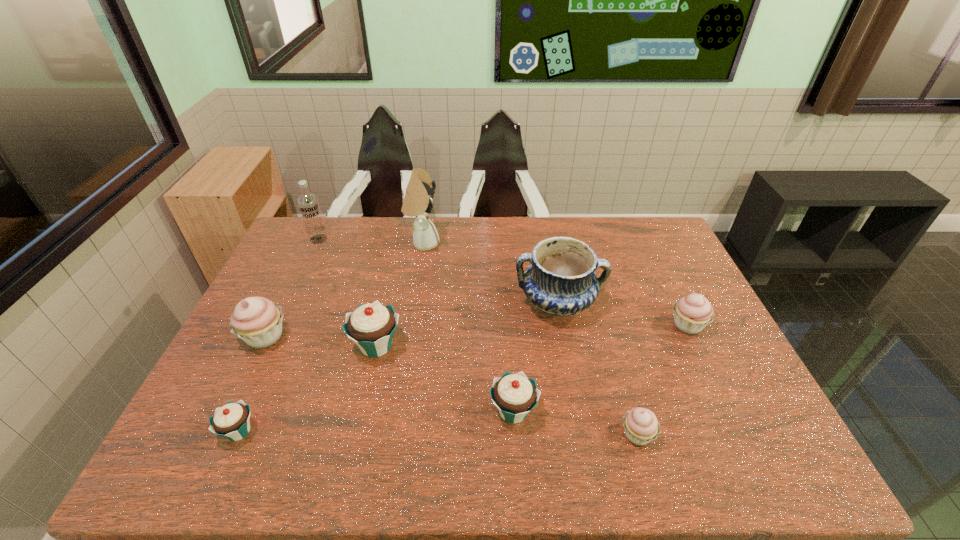
This screenshot has height=540, width=960. Find the location of `pink cupcake that stands as the second closest to the vodka`. pink cupcake that stands as the second closest to the vodka is located at coordinates (641, 426).

Identify which pink cupcake is the nearest to the smallest teal cupcake. Please provide its 2D coordinates. Your answer should be formatted as a tuple, i.e. [(x, y)], where the tuple contains the x and y coordinates of a point satisfying the conditions above.

[(257, 321)]

Where is `teal cupcake that stands as the second closest to the second pink cupcake from left to right`? The width and height of the screenshot is (960, 540). teal cupcake that stands as the second closest to the second pink cupcake from left to right is located at coordinates (371, 326).

Locate an element on the screen. This screenshot has width=960, height=540. the third closest teal cupcake relative to the pottery is located at coordinates (232, 421).

Where is `vacant space that satisfies the following two spatial constraints: 1. on the front side of the smallest pink cupcake; 2. on the left side of the fourth cupcake from left to right`? vacant space that satisfies the following two spatial constraints: 1. on the front side of the smallest pink cupcake; 2. on the left side of the fourth cupcake from left to right is located at coordinates point(515,434).

The height and width of the screenshot is (540, 960). Find the location of `blank space that satisfies the following two spatial constraints: 1. on the front label of the vodka; 2. on the left side of the rightmost teal cupcake`. blank space that satisfies the following two spatial constraints: 1. on the front label of the vodka; 2. on the left side of the rightmost teal cupcake is located at coordinates (238, 411).

Where is `vacant space that satisfies the following two spatial constraints: 1. on the front label of the vodka; 2. on the left side of the second pink cupcake from right to left`? The width and height of the screenshot is (960, 540). vacant space that satisfies the following two spatial constraints: 1. on the front label of the vodka; 2. on the left side of the second pink cupcake from right to left is located at coordinates (228, 434).

Where is `blank space that satisfies the following two spatial constraints: 1. at the front face of the rightmost pink cupcake; 2. on the left side of the doll`? blank space that satisfies the following two spatial constraints: 1. at the front face of the rightmost pink cupcake; 2. on the left side of the doll is located at coordinates (410, 325).

The image size is (960, 540). I want to click on free spot that satisfies the following two spatial constraints: 1. on the back side of the leftmost teal cupcake; 2. on the left side of the pottery, so click(296, 303).